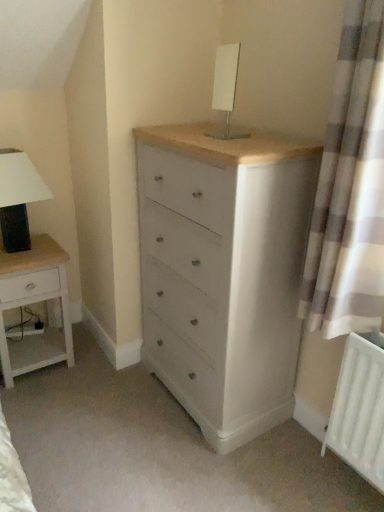
Identify the location of vacant area situated to the left side of matte white chest of drawers at center. (105, 408).